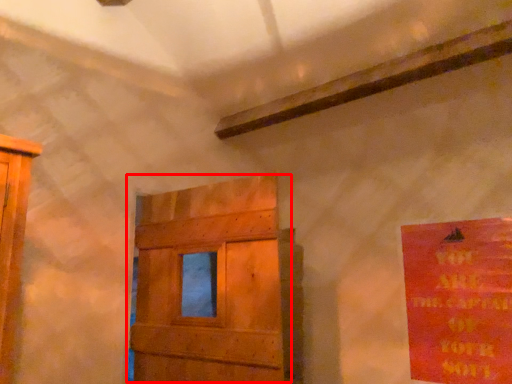
Question: From the image's perspective, what is the correct spatial positioning of door (annotated by the red box) in reference to poster?

Choices:
 (A) above
 (B) below

Answer: (A)